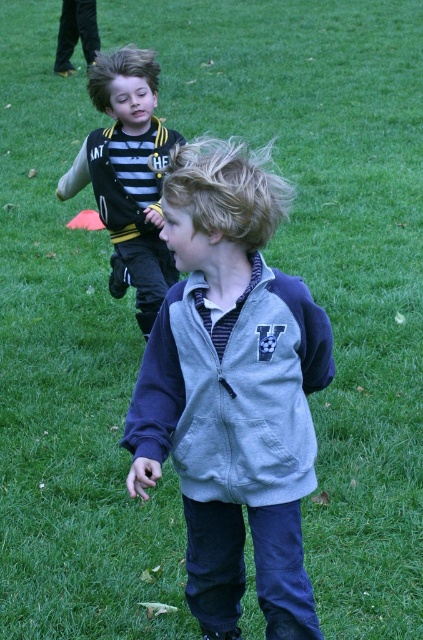
Which of these two, gray fleece jacket at center or striped jersey at left, stands taller?

Standing taller between the two is gray fleece jacket at center.

Who is more forward, (x=260, y=576) or (x=140, y=186)?

Point (x=260, y=576) is more forward.

Identify the location of gray fleece jacket at center. Image resolution: width=423 pixels, height=640 pixels. (233, 388).